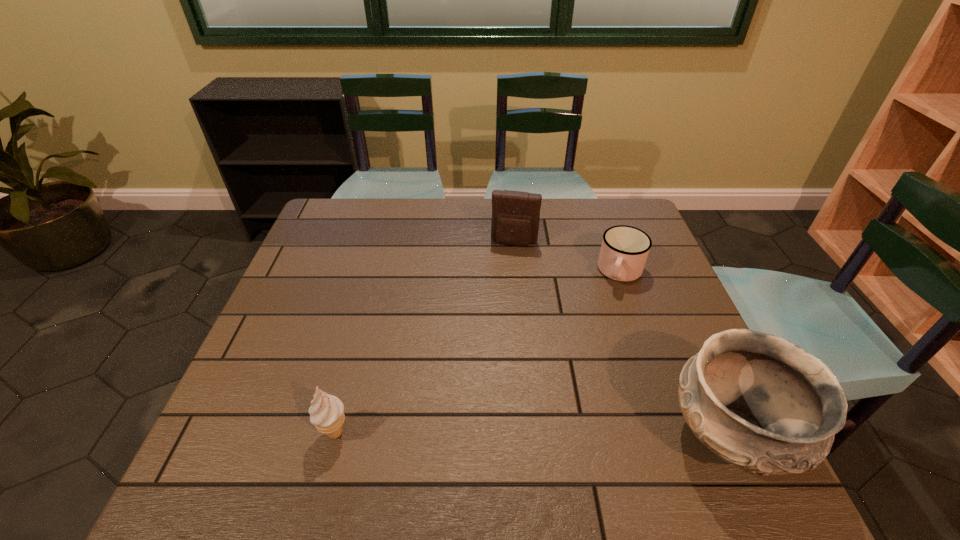
You are a GUI agent. You are given a task and a screenshot of the screen. Output one action in this format:
    pyautogui.click(x=<x>, y=<y>)
    Task: Click on the icecream
    Image resolution: width=960 pixels, height=540 pixels.
    Given the screenshot: What is the action you would take?
    pyautogui.click(x=326, y=412)

The width and height of the screenshot is (960, 540). What are the coordinates of `pottery` in the screenshot? It's located at coord(762,403).

Locate an element on the screen. the farthest object is located at coordinates (515, 220).

This screenshot has width=960, height=540. What are the coordinates of `the third object from right to left` in the screenshot? It's located at (515, 220).

Where is `the second farthest object`? the second farthest object is located at coordinates (624, 250).

Image resolution: width=960 pixels, height=540 pixels. Identify the location of the shortest object. (624, 250).

At what (x,y) coordinates should I click in order to perform the action: click on free space located on the front-facing side of the icecream. Please return your answer as a coordinate pair (x, y). Looking at the image, I should click on (421, 432).

At what (x,y) coordinates should I click in order to perform the action: click on vacant space situated on the left of the pottery. Please return your answer as a coordinate pair (x, y). This screenshot has height=540, width=960. Looking at the image, I should click on (611, 436).

This screenshot has width=960, height=540. In order to click on free space located with an open flap on the second object from left to right in this screenshot , I will do `click(495, 341)`.

Locate an element on the screen. This screenshot has width=960, height=540. free space located 0.150m with an open flap on the second object from left to right is located at coordinates (505, 283).